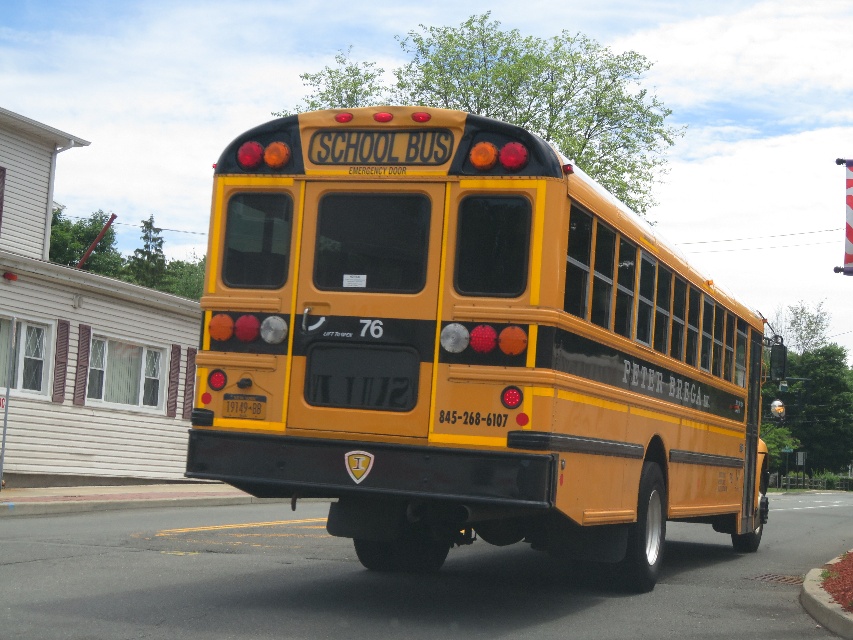
Question: Which point is closer to the camera?

Choices:
 (A) (848, 621)
 (B) (239, 396)

Answer: (A)

Question: Does concrete at lower right appear on the right side of yellow matte license plate at center?

Choices:
 (A) no
 (B) yes

Answer: (B)

Question: Does yellow matte/solid school bus at center appear under concrete at lower right?

Choices:
 (A) yes
 (B) no

Answer: (B)

Question: Does concrete at lower right lie in front of yellow matte license plate at center?

Choices:
 (A) yes
 (B) no

Answer: (A)

Question: Which point appears closest to the camera in this image?

Choices:
 (A) (236, 394)
 (B) (312, 257)
 (C) (840, 620)

Answer: (C)

Question: Which point appears closest to the camera in this image?

Choices:
 (A) (805, 611)
 (B) (264, 397)
 (C) (520, 132)

Answer: (C)